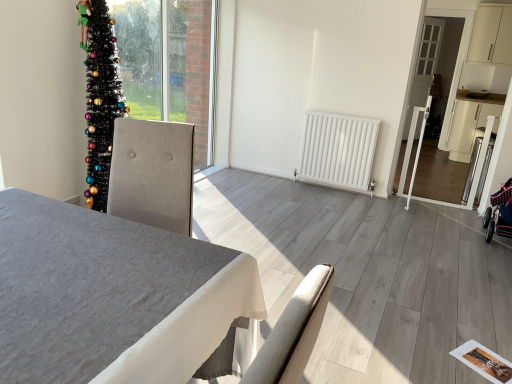
The height and width of the screenshot is (384, 512). I want to click on gray fabric table at center, so click(112, 296).

Image resolution: width=512 pixels, height=384 pixels. Describe the element at coordinates (112, 296) in the screenshot. I see `gray fabric table at center` at that location.

Locate an element on the screen. gray fabric table at center is located at coordinates (112, 296).